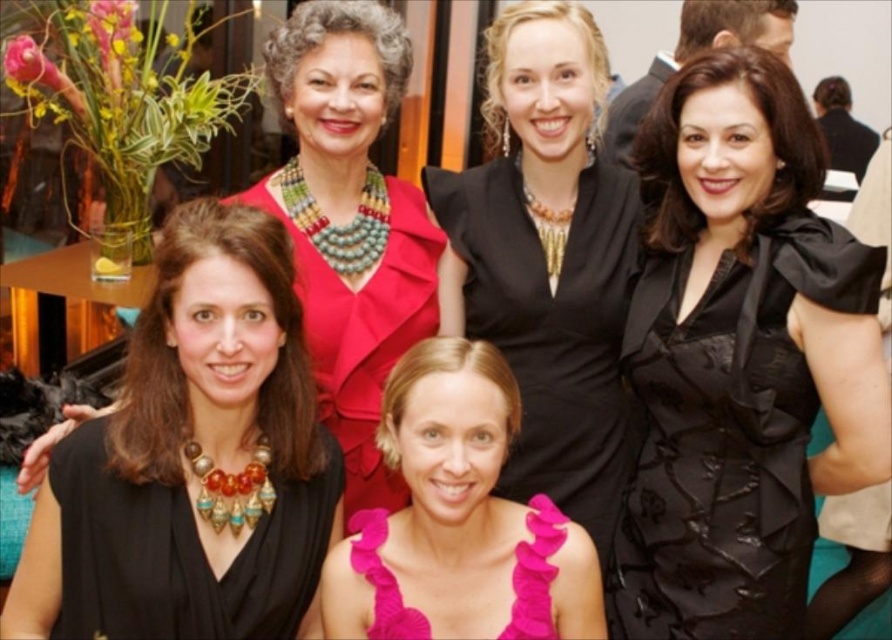
Is matte black dress at center smaller than fuchsia textured fabric dress at center?

No, matte black dress at center is not smaller than fuchsia textured fabric dress at center.

Looking at this image, which of these two, matte black dress at center or fuchsia textured fabric dress at center, stands shorter?

fuchsia textured fabric dress at center

Is point (348, 420) closer to viewer compared to point (395, 582)?

No.

You are a GUI agent. You are given a task and a screenshot of the screen. Output one action in this format:
    pyautogui.click(x=<x>, y=<y>)
    Task: Click on the matte black dress at center
    This screenshot has width=892, height=640.
    Given the screenshot: What is the action you would take?
    pyautogui.click(x=350, y=221)

Is black satin dress at upper center wider than pink satin dress at center?

Incorrect, black satin dress at upper center's width does not surpass pink satin dress at center's.

Can you confirm if black satin dress at upper center is positioned to the left of pink satin dress at center?

No, black satin dress at upper center is not to the left of pink satin dress at center.

Locate an element on the screen. black satin dress at upper center is located at coordinates (547, 260).

From the picture: Between black glossy necklace at center and matte black dress at center, which one is positioned higher?

matte black dress at center is above.

Measure the distance between black glossy necklace at center and camera.

black glossy necklace at center is 1.41 meters away from camera.

Does point (223, 605) come behind point (416, 216)?

No.

In order to click on black glossy necklace at center in this screenshot , I will do `click(188, 461)`.